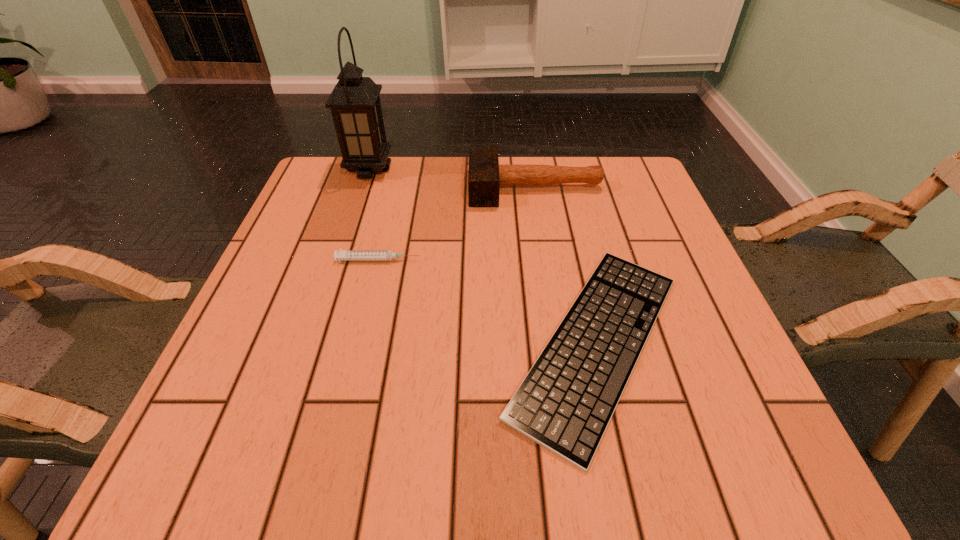
What are the coordinates of `vacant region that satisfies the following two spatial constraints: 1. at the needle end of the computer keyboard; 2. on the right side of the syringe` in the screenshot? It's located at (358, 343).

Locate an element on the screen. The height and width of the screenshot is (540, 960). vacant region that satisfies the following two spatial constraints: 1. on the back side of the shortest object; 2. at the needle end of the syringe is located at coordinates (578, 260).

Locate an element on the screen. The height and width of the screenshot is (540, 960). free location that satisfies the following two spatial constraints: 1. on the hammer head face of the computer keyboard; 2. on the right side of the second tallest object is located at coordinates (560, 343).

You are a GUI agent. You are given a task and a screenshot of the screen. Output one action in this format:
    pyautogui.click(x=<x>, y=<y>)
    Task: Click on the blank area in the image that satisfies the following two spatial constraints: 1. at the needle end of the computer keyboard; 2. on the right side of the second shortest object
    The image size is (960, 540).
    Given the screenshot: What is the action you would take?
    pyautogui.click(x=358, y=343)

Where is `free point that satisfies the following two spatial constraints: 1. on the hammer head face of the computer keyboard; 2. on the right side of the mallet`? free point that satisfies the following two spatial constraints: 1. on the hammer head face of the computer keyboard; 2. on the right side of the mallet is located at coordinates (560, 343).